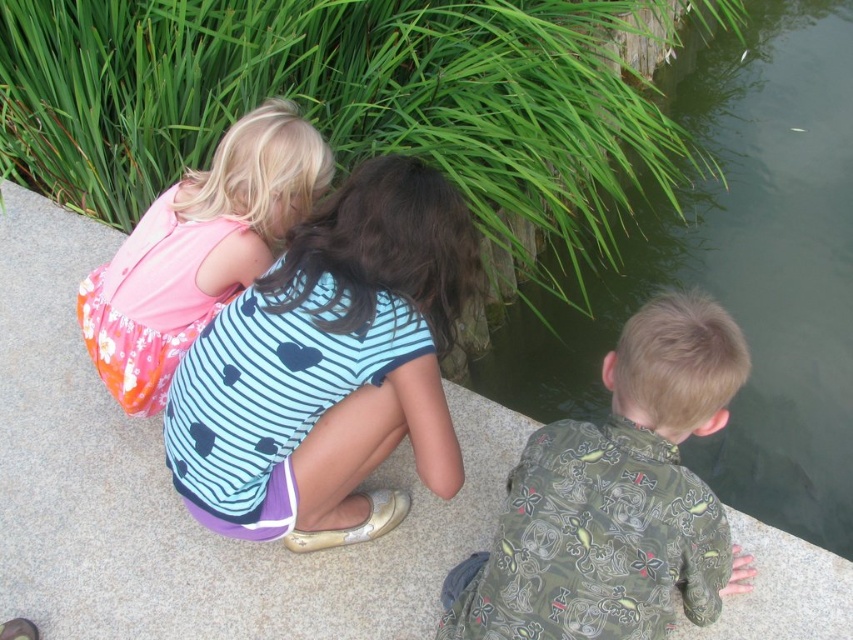
Consider the image. Who is taller, blue striped shirt at center or camouflage-patterned shirt at lower right?

With more height is blue striped shirt at center.

In the scene shown: Is blue striped shirt at center taller than camouflage-patterned shirt at lower right?

Yes.

Identify the location of blue striped shirt at center. The height and width of the screenshot is (640, 853). (328, 365).

Can you confirm if green stone pond at lower right is bigger than blue striped shirt at center?

Indeed, green stone pond at lower right has a larger size compared to blue striped shirt at center.

Does green stone pond at lower right have a greater height compared to blue striped shirt at center?

Yes.

Who is more forward, [834,328] or [360,365]?

Point [360,365]

Where is `green stone pond at lower right`? This screenshot has width=853, height=640. green stone pond at lower right is located at coordinates (737, 272).

Which is more to the right, gray concrete ledge at center or blue striped shirt at center?

blue striped shirt at center is more to the right.

This screenshot has height=640, width=853. I want to click on gray concrete ledge at center, so click(x=175, y=496).